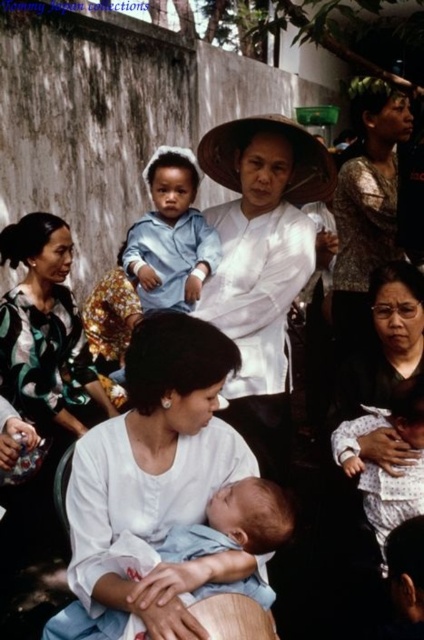
Is white cotton shirt at center above white cotton baby at lower right?

Yes.

Can you confirm if white cotton shirt at center is thinner than white cotton baby at lower right?

In fact, white cotton shirt at center might be wider than white cotton baby at lower right.

This screenshot has height=640, width=424. Find the location of `white cotton shirt at center`. white cotton shirt at center is located at coordinates (153, 483).

Can you confirm if white matte hat at center is positioned to the right of matte blue shirt at upper left?

Yes, white matte hat at center is to the right of matte blue shirt at upper left.

Is white matte hat at center wider than matte blue shirt at upper left?

Indeed, white matte hat at center has a greater width compared to matte blue shirt at upper left.

Is point (250, 442) positioned behind point (184, 260)?

No.

At what (x,y) coordinates should I click in order to perform the action: click on white matte hat at center. Please return your answer as a coordinate pair (x, y). This screenshot has height=640, width=424. Looking at the image, I should click on (262, 266).

Does light blue fabric baby at center appear under matte blue shirt at upper left?

Yes, light blue fabric baby at center is below matte blue shirt at upper left.

This screenshot has height=640, width=424. What do you see at coordinates (225, 541) in the screenshot?
I see `light blue fabric baby at center` at bounding box center [225, 541].

I want to click on light blue fabric baby at center, so click(225, 541).

This screenshot has height=640, width=424. What are the coordinates of `light blue fabric baby at center` in the screenshot? It's located at (225, 541).